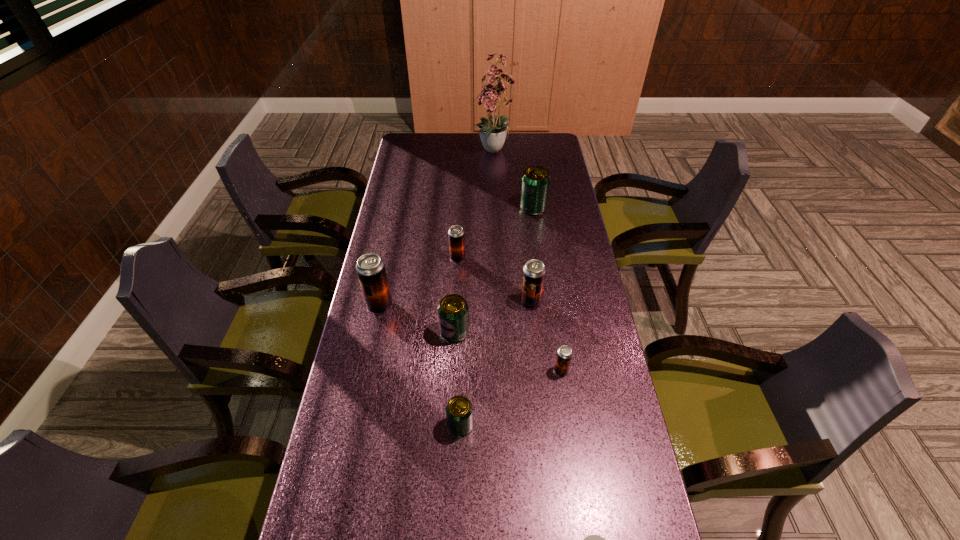
Locate an element on the screen. The width and height of the screenshot is (960, 540). the farthest object is located at coordinates [x=493, y=132].

At what (x,y) coordinates should I click in order to perform the action: click on pink flower arrangement. Please return your answer as a coordinate pair (x, y). The image size is (960, 540). Looking at the image, I should click on (493, 132).

Locate an element on the screen. the leftmost black beer can is located at coordinates (370, 268).

Where is `the biggest black beer can`? The width and height of the screenshot is (960, 540). the biggest black beer can is located at coordinates (370, 268).

Image resolution: width=960 pixels, height=540 pixels. In order to click on the rightmost green beer can in this screenshot , I will do `click(535, 182)`.

Locate an element on the screen. Image resolution: width=960 pixels, height=540 pixels. the farthest green beer can is located at coordinates (535, 182).

The height and width of the screenshot is (540, 960). What are the coordinates of `the third smallest black beer can` in the screenshot? It's located at (533, 278).

Image resolution: width=960 pixels, height=540 pixels. I want to click on the third biggest black beer can, so click(456, 236).

Identify the location of the second black beer can from left to right. The width and height of the screenshot is (960, 540). tap(456, 236).

Where is `the second nearest green beer can`? The height and width of the screenshot is (540, 960). the second nearest green beer can is located at coordinates (453, 311).